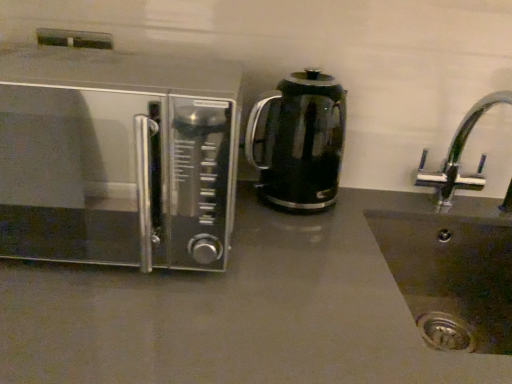
Locate an element on the screen. vacant space to the right of black glass kettle at center is located at coordinates (361, 202).